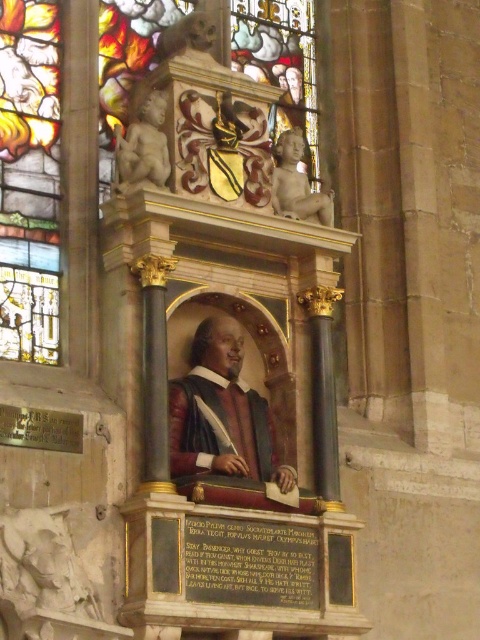
Looking at this image, looking at the memorial, you notice a smooth wooden portrait at center and a smooth marble cherub at upper right. Which object is larger in size?

The smooth wooden portrait at center is bigger than the smooth marble cherub at upper right.

You are an architect designing a new lighting system for the memorial. The smooth wooden portrait at center needs to be illuminated, and the smooth marble cherub at upper right must remain in shadow. Given the distance between them, can you position a spotlight directly in front of the portrait without accidentally lighting the cherub?

The smooth wooden portrait at center and the smooth marble cherub at upper right are 8.49 meters apart. Since the spotlight is placed directly in front of the portrait, the light would spread outward and likely reach the cherub at that distance, making it difficult to keep it in shadow. A different positioning or additional shielding might be necessary.

You are an art conservator assessing the memorial. The stained glass window at upper center and the smooth wooden portrait at center are both in need of restoration. Based on their sizes, which one would require more materials for the restoration process?

The stained glass window at upper center has a larger size compared to the smooth wooden portrait at center, so it would require more materials for the restoration process.